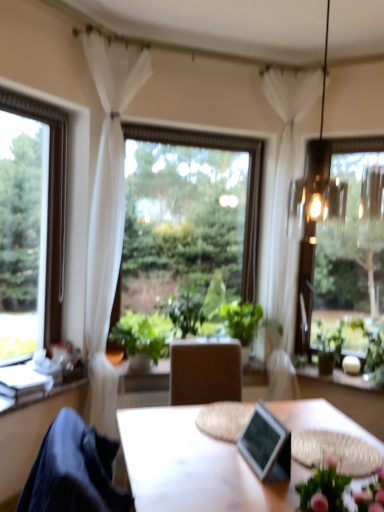
The width and height of the screenshot is (384, 512). What are the coordinates of `clear glass window at left, which ranks as the first window in left-to-right order` in the screenshot? It's located at (31, 225).

You are a GUI agent. You are given a task and a screenshot of the screen. Output one action in this format:
    pyautogui.click(x=<x>, y=<y>)
    Task: Click on the white sheer curtain at left, acting as the first curtain starting from the left
    The image size is (384, 512).
    Given the screenshot: What is the action you would take?
    pyautogui.click(x=108, y=215)

Image resolution: width=384 pixels, height=512 pixels. What are the coordinates of `dark blue fabric at lower left` in the screenshot? It's located at (73, 471).

This screenshot has height=512, width=384. I want to click on green leafy plant at right, which is the third houseplant in left-to-right order, so click(329, 348).

You are a GUI agent. You are given a task and a screenshot of the screen. Output one action in this format:
    pyautogui.click(x=<x>, y=<y>)
    Task: Click on the picture frame below the transparent glass window at center, which appears as the 2th window when viewed from the right (from a real-world perspective)
    Image resolution: width=384 pixels, height=512 pixels.
    Given the screenshot: What is the action you would take?
    coord(266,445)

Is transparent glass window at center, positioned as the 2th window in left-to-right order, situated inside metallic silver picture frame at center or outside?

transparent glass window at center, positioned as the 2th window in left-to-right order, cannot be found inside metallic silver picture frame at center.

Is point (144, 293) closer to viewer compared to point (260, 455)?

No, it is behind (260, 455).

From the image's perspective, is green leafy plant at right, which is the third houseplant in left-to-right order, positioned above or below clear glass window at left, which is the 3th window from right to left?

Clearly, from the image's perspective, green leafy plant at right, which is the third houseplant in left-to-right order, is below clear glass window at left, which is the 3th window from right to left.

Is green leafy plant at right, which is the third houseplant in left-to-right order, completely or partially outside of clear glass window at left, which ranks as the first window in left-to-right order?

That's correct, green leafy plant at right, which is the third houseplant in left-to-right order, is outside of clear glass window at left, which ranks as the first window in left-to-right order.

Does green leafy plant at right, the 1th houseplant from the right, turn towards clear glass window at left, which is the 3th window from right to left?

No.

Does transparent glass window at right, which is counted as the third window, starting from the left, have a lesser width compared to clear glass window at left, which is the 3th window from right to left?

Indeed, transparent glass window at right, which is counted as the third window, starting from the left, has a lesser width compared to clear glass window at left, which is the 3th window from right to left.

From the image's perspective, which is below, transparent glass window at right, the 1th window in the right-to-left sequence, or clear glass window at left, which is the 3th window from right to left?

transparent glass window at right, the 1th window in the right-to-left sequence, from the image's perspective.

Is transparent glass window at right, the 1th window in the right-to-left sequence, to the right of clear glass window at left, which is the 3th window from right to left, from the viewer's perspective?

Indeed, transparent glass window at right, the 1th window in the right-to-left sequence, is positioned on the right side of clear glass window at left, which is the 3th window from right to left.

Is clear glass window at left, which ranks as the first window in left-to-right order, taller than green leafy plant at right, the 1th houseplant from the right?

Correct, clear glass window at left, which ranks as the first window in left-to-right order, is much taller as green leafy plant at right, the 1th houseplant from the right.

Is clear glass window at left, which is the 3th window from right to left, inside or outside of green leafy plant at right, which is the third houseplant in left-to-right order?

The correct answer is: outside.

Which of these two, clear glass window at left, which is the 3th window from right to left, or green leafy plant at right, which is the third houseplant in left-to-right order, is bigger?

clear glass window at left, which is the 3th window from right to left.

Does clear glass window at left, which is the 3th window from right to left, have a lesser width compared to green leafy plant at right, the 1th houseplant from the right?

Yes.

Looking at their sizes, would you say metallic silver picture frame at center is wider or thinner than white sheer curtain at left, marked as the second curtain in a right-to-left arrangement?

Clearly, metallic silver picture frame at center has less width compared to white sheer curtain at left, marked as the second curtain in a right-to-left arrangement.

Are metallic silver picture frame at center and white sheer curtain at left, acting as the first curtain starting from the left, located far from each other?

Yes.

Is metallic silver picture frame at center positioned with its back to white sheer curtain at left, acting as the first curtain starting from the left?

No, white sheer curtain at left, acting as the first curtain starting from the left, is not at the back of metallic silver picture frame at center.

Can you confirm if green leafy plant at center, the first houseplant from the left, is positioned to the left of white sheer curtain at left, acting as the first curtain starting from the left?

No, green leafy plant at center, the first houseplant from the left, is not to the left of white sheer curtain at left, acting as the first curtain starting from the left.

Is green leafy plant at center, arranged as the third houseplant when viewed from the right, looking in the opposite direction of white sheer curtain at left, marked as the second curtain in a right-to-left arrangement?

That's right, green leafy plant at center, arranged as the third houseplant when viewed from the right, is facing away from white sheer curtain at left, marked as the second curtain in a right-to-left arrangement.

Where is `curtain located in front of the green leafy plant at center, arranged as the third houseplant when viewed from the right`? curtain located in front of the green leafy plant at center, arranged as the third houseplant when viewed from the right is located at coordinates (108, 215).

From the image's perspective, would you say green leafy plant at center, arranged as the third houseplant when viewed from the right, is positioned over white sheer curtain at left, acting as the first curtain starting from the left?

Actually, green leafy plant at center, arranged as the third houseplant when viewed from the right, appears below white sheer curtain at left, acting as the first curtain starting from the left, in the image.

Is white sheer curtain at upper center, marked as the second curtain in a left-to-right arrangement, in contact with transparent glass window at right, which is counted as the third window, starting from the left?

No, white sheer curtain at upper center, marked as the second curtain in a left-to-right arrangement, is not touching transparent glass window at right, which is counted as the third window, starting from the left.

Considering the positions of objects white sheer curtain at upper center, marked as the second curtain in a left-to-right arrangement, and transparent glass window at right, the 1th window in the right-to-left sequence, in the image provided, who is more to the left, white sheer curtain at upper center, marked as the second curtain in a left-to-right arrangement, or transparent glass window at right, the 1th window in the right-to-left sequence,?

white sheer curtain at upper center, marked as the second curtain in a left-to-right arrangement.

Is white sheer curtain at upper center, marked as the second curtain in a left-to-right arrangement, bigger or smaller than transparent glass window at right, which is counted as the third window, starting from the left?

white sheer curtain at upper center, marked as the second curtain in a left-to-right arrangement, is bigger than transparent glass window at right, which is counted as the third window, starting from the left.

Considering the relative sizes of white sheer curtain at upper center, marked as the second curtain in a left-to-right arrangement, and transparent glass window at right, which is counted as the third window, starting from the left, in the image provided, is white sheer curtain at upper center, marked as the second curtain in a left-to-right arrangement, wider than transparent glass window at right, which is counted as the third window, starting from the left,?

Yes, white sheer curtain at upper center, marked as the second curtain in a left-to-right arrangement, is wider than transparent glass window at right, which is counted as the third window, starting from the left.

Which window is the 2nd one when counting from the back of the metallic silver picture frame at center? Please provide its 2D coordinates.

[(188, 215)]

This screenshot has height=512, width=384. I want to click on the 3rd window above the green leafy plant at right, which is the third houseplant in left-to-right order (from a real-world perspective), so click(31, 225).

Estimate the real-world distances between objects in this image. Which object is further from green matte vase at right, clear glass window at left, which is the 3th window from right to left, or green leafy plant at center, arranged as the third houseplant when viewed from the right?

Based on the image, clear glass window at left, which is the 3th window from right to left, appears to be further to green matte vase at right.

Consider the image. Considering their positions, is white sheer curtain at upper center, marked as the second curtain in a left-to-right arrangement, positioned further to green leafy plant at center, positioned as the second houseplant in right-to-left order, than dark blue fabric at lower left?

dark blue fabric at lower left.

Looking at the image, which one is located further to dark blue fabric at lower left, green matte vase at right or transparent glass window at right, the 1th window in the right-to-left sequence?

transparent glass window at right, the 1th window in the right-to-left sequence, is positioned further to the anchor dark blue fabric at lower left.

In the scene shown: From the image, which object appears to be farther from transparent glass window at right, which is counted as the third window, starting from the left, green matte vase at right or metallic silver picture frame at center?

metallic silver picture frame at center is positioned further to the anchor transparent glass window at right, which is counted as the third window, starting from the left.

Which object lies nearer to the anchor point clear glass window at left, which ranks as the first window in left-to-right order, pink fabric floral at lower right or transparent glass window at center, positioned as the 2th window in left-to-right order?

Among the two, transparent glass window at center, positioned as the 2th window in left-to-right order, is located nearer to clear glass window at left, which ranks as the first window in left-to-right order.

From the image, which object appears to be nearer to clear glass window at left, which ranks as the first window in left-to-right order, green leafy plant at center, arranged as the third houseplant when viewed from the right, or dark blue fabric at lower left?

Based on the image, green leafy plant at center, arranged as the third houseplant when viewed from the right, appears to be nearer to clear glass window at left, which ranks as the first window in left-to-right order.

Looking at the image, which one is located further to pink fabric floral at lower right, green leafy plant at center, arranged as the third houseplant when viewed from the right, or metallic silver picture frame at center?

green leafy plant at center, arranged as the third houseplant when viewed from the right, is positioned further to the anchor pink fabric floral at lower right.

From the image, which object appears to be farther from white sheer curtain at upper center, marked as the second curtain in a left-to-right arrangement, green leafy plant at center, positioned as the 2th houseplant in left-to-right order, or clear glass window at left, which is the 3th window from right to left?

clear glass window at left, which is the 3th window from right to left, lies further to white sheer curtain at upper center, marked as the second curtain in a left-to-right arrangement, than the other object.

Find the location of a particular element. The height and width of the screenshot is (512, 384). window between white sheer curtain at left, acting as the first curtain starting from the left, and green leafy plant at right, the 1th houseplant from the right, from left to right is located at coordinates (188, 215).

I want to click on curtain located between green leafy plant at center, arranged as the third houseplant when viewed from the right, and green leafy plant at right, the 1th houseplant from the right, in the left-right direction, so click(x=287, y=194).

Identify the location of window sill between clear glass window at left, which is the 3th window from right to left, and transparent glass window at right, the 1th window in the right-to-left sequence, in the horizontal direction. click(338, 379).

The image size is (384, 512). What are the coordinates of `window between green leafy plant at center, arranged as the third houseplant when viewed from the right, and green leafy plant at center, positioned as the second houseplant in right-to-left order, from left to right` in the screenshot? It's located at (188, 215).